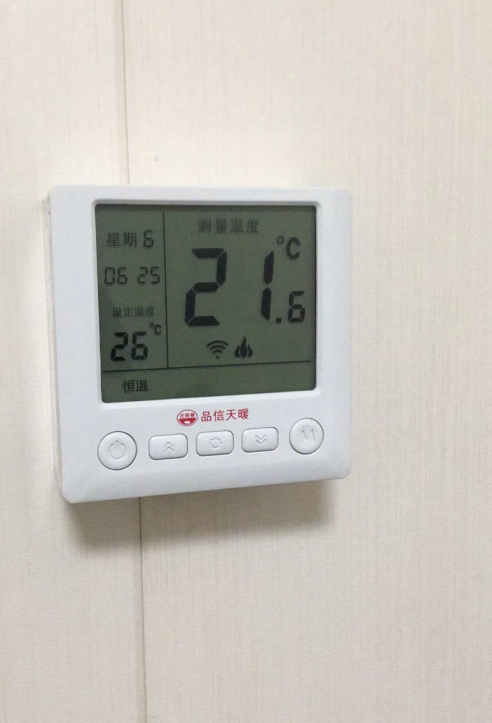
This screenshot has height=723, width=492. In order to click on wall in this screenshot , I will do `click(240, 594)`.